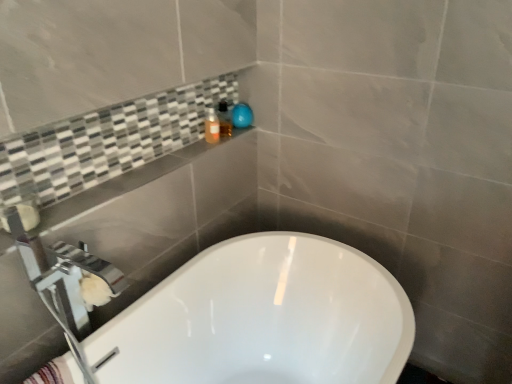
You are a GUI agent. You are given a task and a screenshot of the screen. Output one action in this format:
    pyautogui.click(x=<x>, y=<y>)
    Task: Click on the vacant space in front of matte orange bottle at upper center, which ranks as the first toiletry in left-to-right order
    Image resolution: width=512 pixels, height=384 pixels.
    Given the screenshot: What is the action you would take?
    pyautogui.click(x=193, y=150)